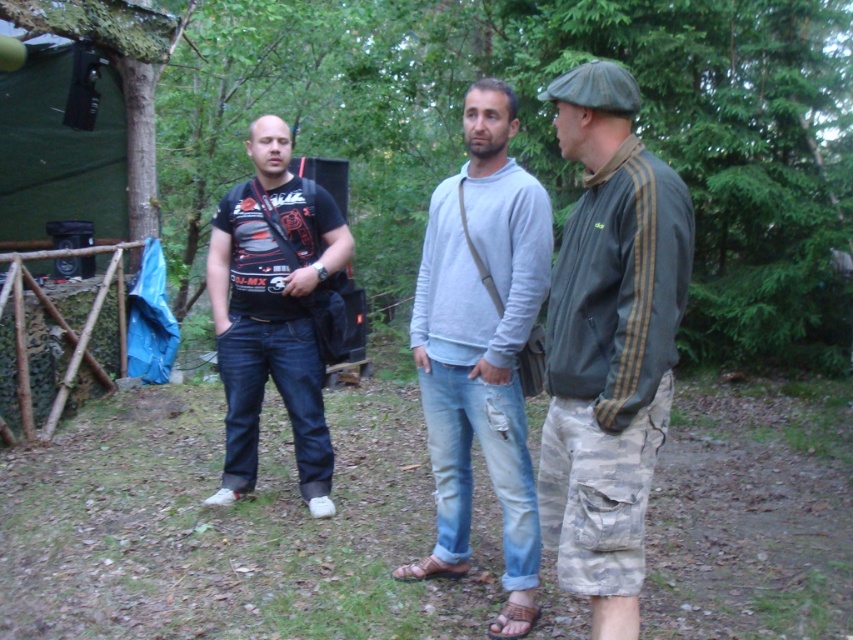
Can you confirm if camouflage cargo shorts at right is wider than gray cotton sweater at center?

No.

Can you confirm if camouflage cargo shorts at right is bigger than gray cotton sweater at center?

No.

Is point (608, 436) farther from camera compared to point (485, 150)?

No, it is in front of (485, 150).

Identify the location of camouflage cargo shorts at right. This screenshot has height=640, width=853. (608, 342).

How far apart are gray cotton sweater at center and black matte t-shirt at center?

gray cotton sweater at center and black matte t-shirt at center are 3.81 feet apart.

Is gray cotton sweater at center closer to the viewer compared to black matte t-shirt at center?

That is True.

Is point (456, 330) positioned after point (218, 333)?

No, it is not.

This screenshot has height=640, width=853. I want to click on gray cotton sweater at center, so click(480, 348).

Can you confirm if camouflage cargo shorts at right is wider than black matte t-shirt at center?

In fact, camouflage cargo shorts at right might be narrower than black matte t-shirt at center.

Find the location of a particular element. Image resolution: width=853 pixels, height=640 pixels. camouflage cargo shorts at right is located at coordinates (608, 342).